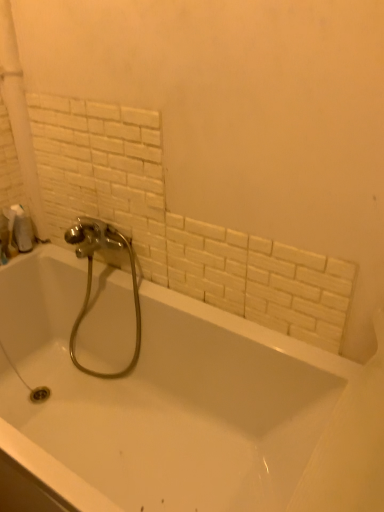
Question: Does white glossy bathtub at center have a lesser height compared to chrome metallic faucet at center?

Choices:
 (A) yes
 (B) no

Answer: (A)

Question: From the image's perspective, is white glossy bathtub at center over chrome metallic faucet at center?

Choices:
 (A) yes
 (B) no

Answer: (B)

Question: Is white glossy bathtub at center wider than chrome metallic faucet at center?

Choices:
 (A) no
 (B) yes

Answer: (B)

Question: Is chrome metallic faucet at center surrounded by white glossy bathtub at center?

Choices:
 (A) no
 (B) yes

Answer: (B)

Question: Is white glossy bathtub at center not within chrome metallic faucet at center?

Choices:
 (A) no
 (B) yes

Answer: (B)

Question: Is white glossy bathtub at center next to chrome metallic faucet at center and touching it?

Choices:
 (A) yes
 (B) no

Answer: (B)

Question: Considering the relative sizes of chrome metallic faucet at center and white matte toilet paper at left in the image provided, is chrome metallic faucet at center wider than white matte toilet paper at left?

Choices:
 (A) no
 (B) yes

Answer: (B)

Question: From a real-world perspective, is chrome metallic faucet at center under white matte toilet paper at left?

Choices:
 (A) yes
 (B) no

Answer: (A)

Question: Could white matte toilet paper at left be considered to be inside chrome metallic faucet at center?

Choices:
 (A) yes
 (B) no

Answer: (B)

Question: Can you confirm if chrome metallic faucet at center is bigger than white matte toilet paper at left?

Choices:
 (A) no
 (B) yes

Answer: (B)

Question: From the image's perspective, is chrome metallic faucet at center located above white matte toilet paper at left?

Choices:
 (A) yes
 (B) no

Answer: (B)

Question: Would you consider chrome metallic faucet at center to be distant from white matte toilet paper at left?

Choices:
 (A) no
 (B) yes

Answer: (A)

Question: Considering the relative sizes of white glossy bathtub at center and white matte toilet paper at left in the image provided, is white glossy bathtub at center taller than white matte toilet paper at left?

Choices:
 (A) yes
 (B) no

Answer: (A)